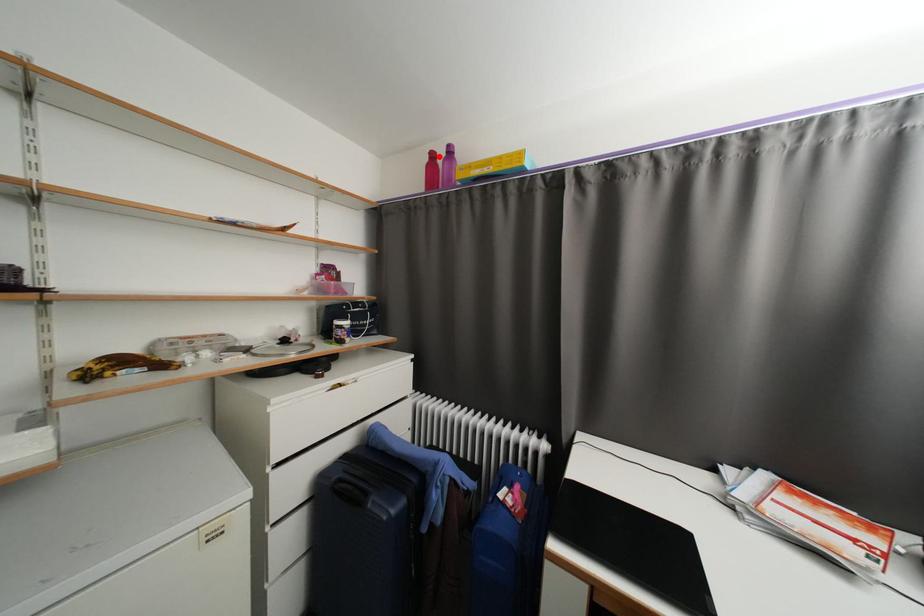
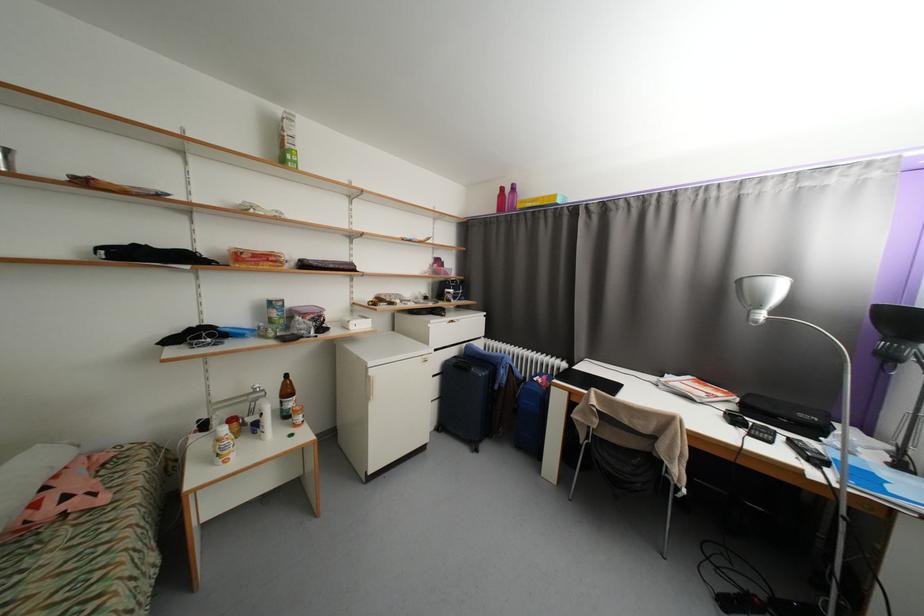
Find the pixel in the second image that matches the highlighted location in the first image.

(508, 190)